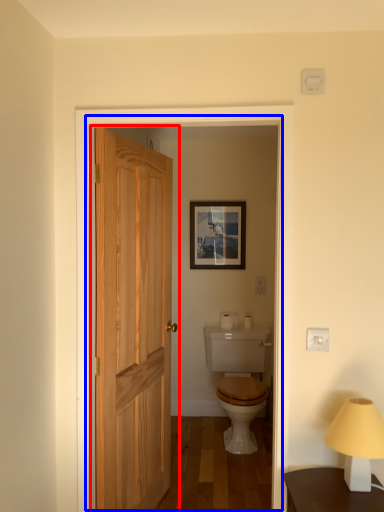
Question: Which object is closer to the camera taking this photo, door (highlighted by a red box) or screen door (highlighted by a blue box)?

Choices:
 (A) door
 (B) screen door

Answer: (B)